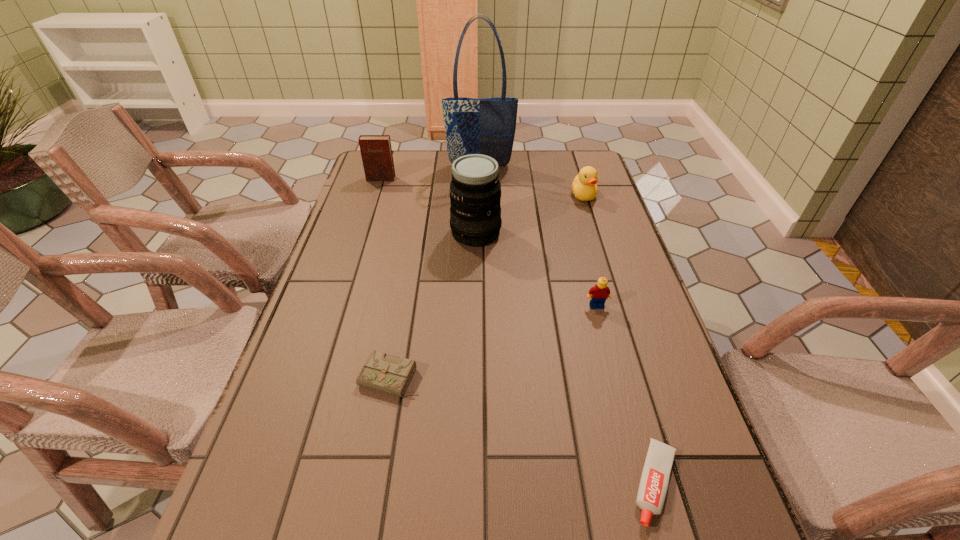
At what (x,y) coordinates should I click in order to perform the action: click on diary situated at the far edge. Please return your answer as a coordinate pair (x, y). Looking at the image, I should click on (376, 152).

Where is `duckling present at the far edge`? Image resolution: width=960 pixels, height=540 pixels. duckling present at the far edge is located at coordinates (584, 187).

Identify the location of duckling located in the right edge section of the desktop. This screenshot has height=540, width=960. (584, 187).

Where is `Lego located in the right edge section of the desktop`? Lego located in the right edge section of the desktop is located at coordinates (600, 292).

At what (x,y) coordinates should I click in order to perform the action: click on toothpaste that is at the right edge. Please return your answer as a coordinate pair (x, y). The height and width of the screenshot is (540, 960). Looking at the image, I should click on click(653, 486).

Locate an element on the screen. The image size is (960, 540). object situated at the far left corner is located at coordinates (376, 152).

Image resolution: width=960 pixels, height=540 pixels. What are the coordinates of `object that is at the far right corner` in the screenshot? It's located at (584, 187).

Locate an element on the screen. This screenshot has width=960, height=540. blank space at the far edge is located at coordinates (518, 180).

At what (x,y) coordinates should I click in order to perform the action: click on free point at the left edge. Please return your answer as a coordinate pair (x, y). Image resolution: width=960 pixels, height=540 pixels. Looking at the image, I should click on (352, 389).

The width and height of the screenshot is (960, 540). I want to click on free location at the right edge, so click(604, 364).